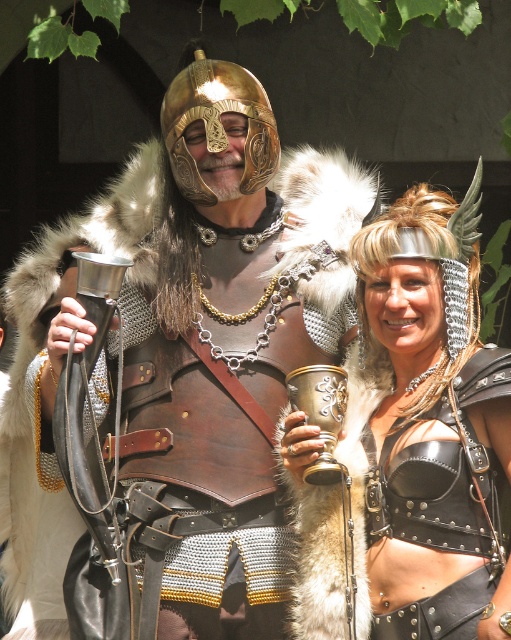
Question: Does polished brass helmet at center appear on the right side of shiny gold cup at center?

Choices:
 (A) yes
 (B) no

Answer: (B)

Question: Which point is closer to the camera taking this photo?

Choices:
 (A) (367, 566)
 (B) (267, 236)

Answer: (A)

Question: Considering the relative positions of polished brass helmet at center and shiny gold cup at center in the image provided, where is polished brass helmet at center located with respect to shiny gold cup at center?

Choices:
 (A) left
 (B) right

Answer: (A)

Question: Which object appears farthest from the camera in this image?

Choices:
 (A) polished brass helmet at center
 (B) shiny gold cup at center

Answer: (A)

Question: Which of the following is the closest to the observer?

Choices:
 (A) polished brass helmet at center
 (B) shiny gold cup at center

Answer: (B)

Question: Can you confirm if polished brass helmet at center is bigger than shiny gold cup at center?

Choices:
 (A) no
 (B) yes

Answer: (B)